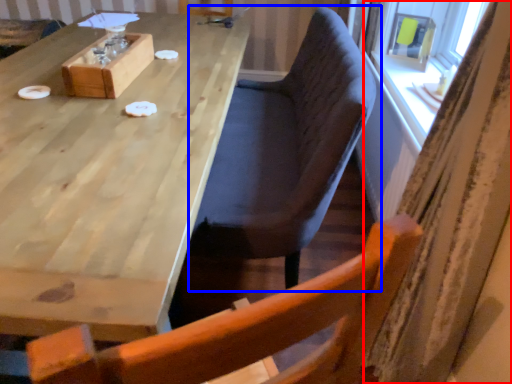
Question: Which object is closer to the camera taking this photo, curtain (highlighted by a red box) or chair (highlighted by a blue box)?

Choices:
 (A) curtain
 (B) chair

Answer: (A)